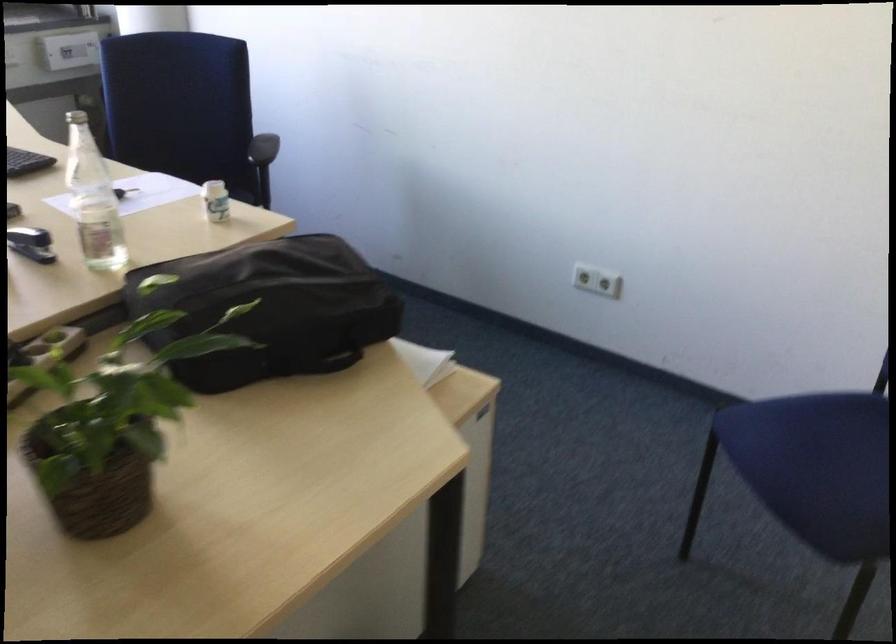
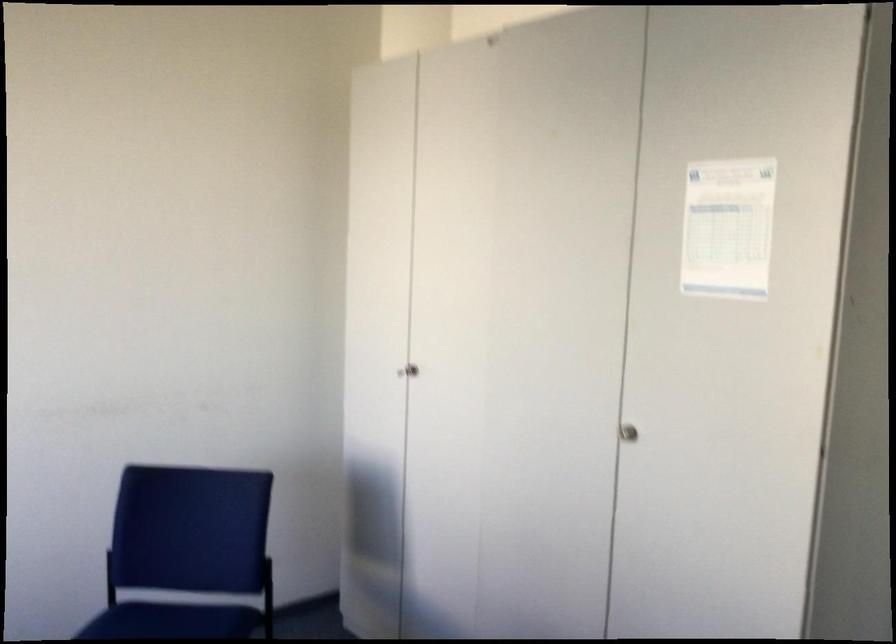
Question: The camera is either moving clockwise (left) or counter-clockwise (right) around the object. The first image is from the beginning of the video and the second image is from the end. Is the camera moving left or right when shooting the video?

Choices:
 (A) Left
 (B) Right

Answer: (A)